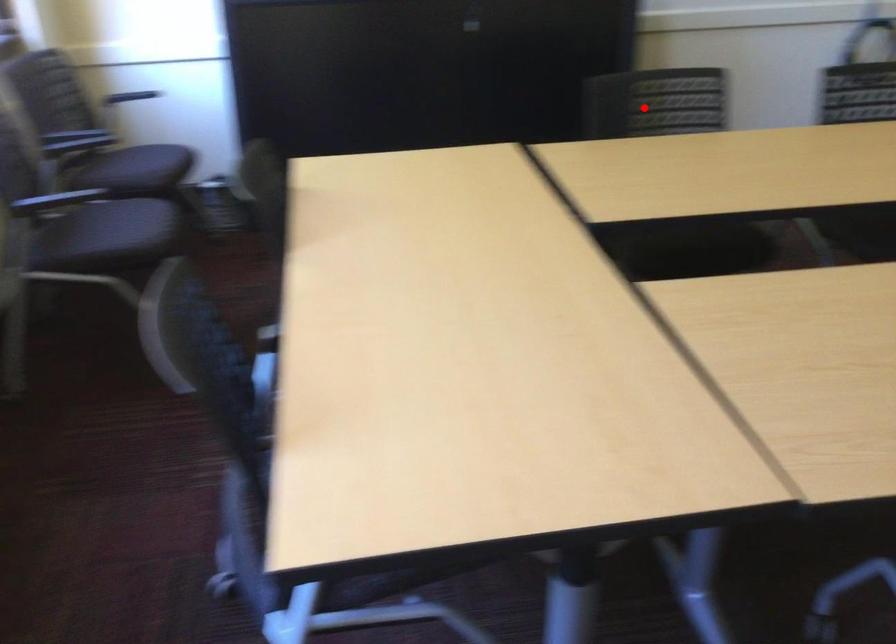
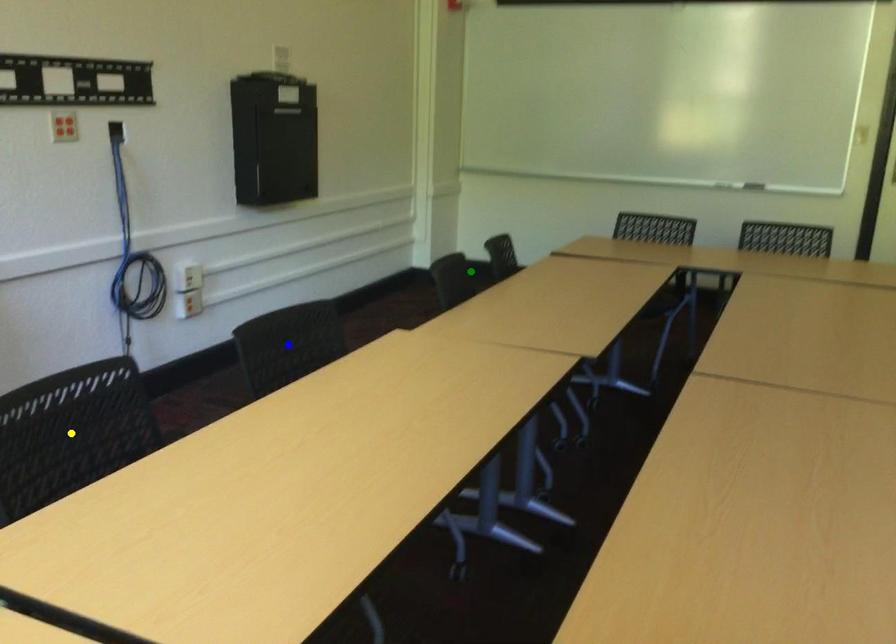
Question: I am providing you with two images of the same scene from different viewpoints. A red point is marked on the first image. You are given multiple points on the second image. Which mark in image 2 goes with the point in image 1?

Choices:
 (A) blue point
 (B) green point
 (C) yellow point

Answer: (C)